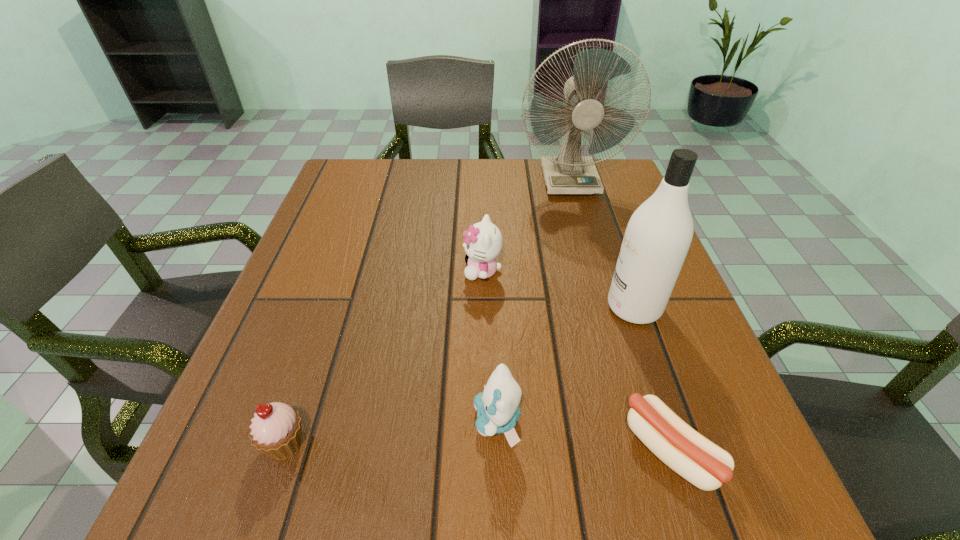
This screenshot has width=960, height=540. Identify the location of vacant point located between the cupcake and the fifth nearest object. pyautogui.click(x=384, y=357).

The image size is (960, 540). What are the coordinates of `vacant space that is in between the cupcake and the fan` in the screenshot? It's located at (427, 312).

Identify the location of free space that is in between the third farthest object and the farther kitten. (558, 289).

Find the location of a particular element. The image size is (960, 540). vacant space that's between the shampoo and the nearer kitten is located at coordinates (565, 364).

Find the location of `free space that is in between the leftmost object and the farthest object`. free space that is in between the leftmost object and the farthest object is located at coordinates (427, 312).

Where is `the third closest object to the fan`? This screenshot has height=540, width=960. the third closest object to the fan is located at coordinates (497, 407).

Locate an element on the screen. The image size is (960, 540). the fifth closest object to the nearer kitten is located at coordinates (568, 173).

Where is `vacant point that satisfies the following two spatial constraints: 1. on the front-facing side of the shortest object; 2. on the left side of the farthest object`? The width and height of the screenshot is (960, 540). vacant point that satisfies the following two spatial constraints: 1. on the front-facing side of the shortest object; 2. on the left side of the farthest object is located at coordinates (647, 451).

Identify the location of vacant area in the image that satisfies the following two spatial constraints: 1. on the front-facing side of the fan; 2. on the right side of the shortest object. (647, 451).

At what (x,y) coordinates should I click in order to perform the action: click on free space in the image that satisfies the following two spatial constraints: 1. on the face of the nearer kitten; 2. on the front side of the cupcake. Please return your answer as a coordinate pair (x, y). The width and height of the screenshot is (960, 540). Looking at the image, I should click on (497, 444).